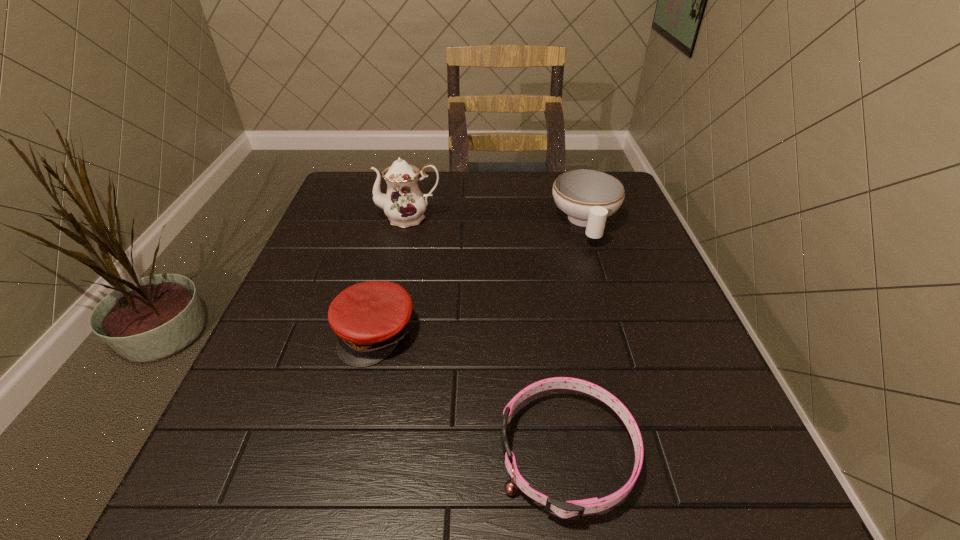
In the image, there is a desktop. Where is `vacant space at the far edge`? Image resolution: width=960 pixels, height=540 pixels. vacant space at the far edge is located at coordinates (435, 177).

The width and height of the screenshot is (960, 540). In the image, there is a desktop. Identify the location of vacant space at the near edge. (332, 480).

Find the location of a particular element. Image resolution: width=960 pixels, height=540 pixels. vacant space at the left edge of the desktop is located at coordinates (311, 354).

Identify the location of free space at the right edge of the desktop. The height and width of the screenshot is (540, 960). (725, 423).

Image resolution: width=960 pixels, height=540 pixels. I want to click on free space at the near left corner, so click(x=210, y=529).

This screenshot has width=960, height=540. In the image, there is a desktop. What are the coordinates of `vacant area at the far right corner` in the screenshot? It's located at (625, 195).

I want to click on free space between the right chinaware and the left chinaware, so (x=497, y=220).

Identify the location of vacant area between the dog collar and the third tallest object. (471, 393).

In order to click on empty location between the shortest object and the left chinaware in this screenshot , I will do 489,335.

I want to click on unoccupied position between the shorter chinaware and the left chinaware, so click(x=497, y=220).